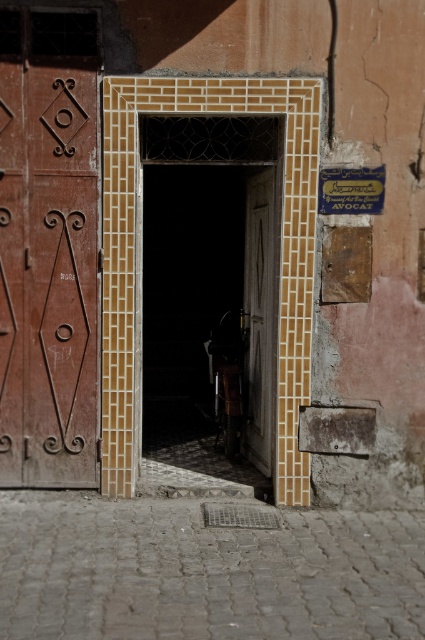
Question: Which object appears closest to the camera in this image?

Choices:
 (A) wooden carved door at left
 (B) matte wooden door at center

Answer: (A)

Question: Can you confirm if matte wooden door at center is positioned below wooden carved door at left?

Choices:
 (A) yes
 (B) no

Answer: (A)

Question: Is matte wooden door at center in front of wooden carved door at left?

Choices:
 (A) yes
 (B) no

Answer: (B)

Question: Which object appears closest to the camera in this image?

Choices:
 (A) wooden carved door at left
 (B) matte wooden door at center

Answer: (A)

Question: Among these points, which one is farthest from the camera?

Choices:
 (A) (17, 97)
 (B) (240, 140)

Answer: (B)

Question: Does matte wooden door at center appear over wooden carved door at left?

Choices:
 (A) yes
 (B) no

Answer: (B)